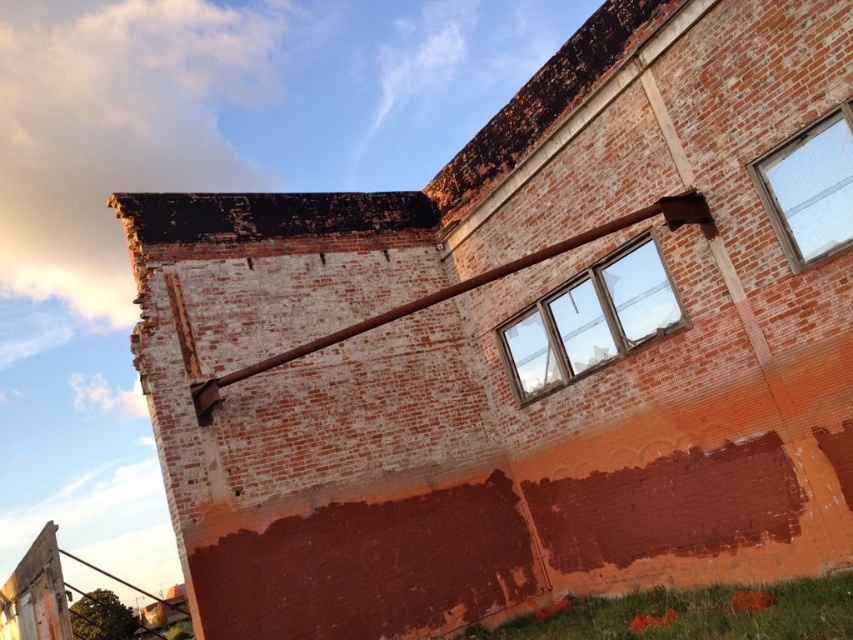
Based on the photo, you are standing at the base of the weathered brick building and want to reach the point labeled point (634,321). However, there is an obstacle at point (817,236). Will you encounter the obstacle before reaching your destination?

Yes, you will encounter the obstacle at point (817,236) before reaching point (634,321) because point (634,321) is behind point (817,236).

You are an architect assessing the structural integrity of the building. You notice two clear glass windows in the building. Which window, the clear glass window at center or the clear glass window at upper right, has a greater width?

The clear glass window at center might be wider than clear glass window at upper right according to the description provided.

You are standing at the origin point of the coordinate system. You want to throw a ball towards the clear glass window at center. What are the coordinates you should aim for?

The clear glass window at center is located at coordinates point (590, 317), so you should aim for that point.